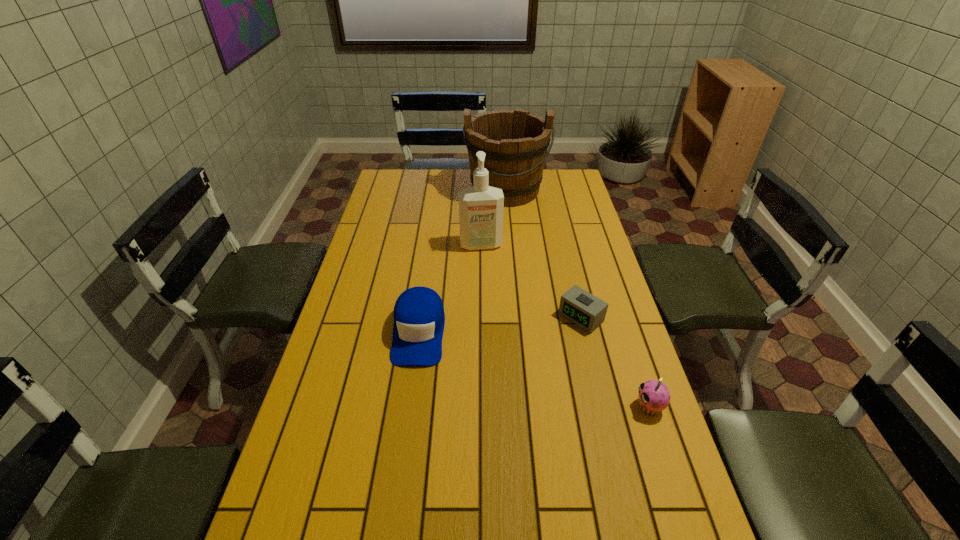
Locate an element on the screen. the leftmost object is located at coordinates (419, 318).

The height and width of the screenshot is (540, 960). What are the coordinates of `the rightmost object` in the screenshot? It's located at (654, 396).

Locate an element on the screen. the nearest object is located at coordinates (654, 396).

Identify the location of the shortest object. (582, 308).

This screenshot has height=540, width=960. Find the location of `cleansing agent`. cleansing agent is located at coordinates (481, 207).

You are a GUI agent. You are given a task and a screenshot of the screen. Output one action in this format:
    pyautogui.click(x=<x>, y=<y>)
    Task: Click on the farthest object
    Image resolution: width=960 pixels, height=540 pixels.
    Given the screenshot: What is the action you would take?
    pyautogui.click(x=515, y=142)

In order to click on vacant space located on the front-facing side of the baseball cap in this screenshot , I will do `click(411, 389)`.

Where is `vacant space located on the face of the cupcake`? This screenshot has width=960, height=540. vacant space located on the face of the cupcake is located at coordinates (558, 407).

At what (x,y) coordinates should I click in order to perform the action: click on vacant space located on the face of the cupcake. Please return your answer as a coordinate pair (x, y). Looking at the image, I should click on (604, 407).

In order to click on free region located 0.360m on the face of the cupcake in this screenshot , I will do 495,407.